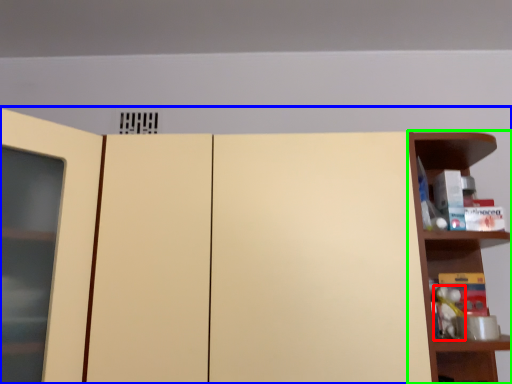
Question: Estimate the real-world distances between objects in this image. Which object is farther from toy (highlighted by a red box), cupboard (highlighted by a blue box) or shelf (highlighted by a green box)?

Choices:
 (A) cupboard
 (B) shelf

Answer: (A)